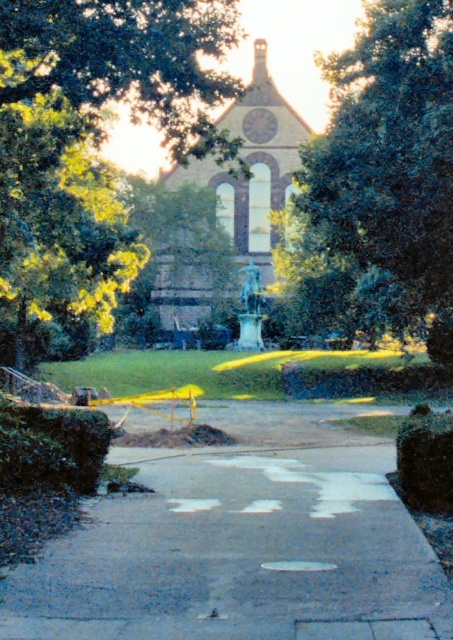
You are a tourist standing at the entrance of the park and want to take a photo of the gray concrete sidewalk at center and the green leafy tree at upper center. Which object should you focus on first to ensure both are in the frame?

You should focus on the gray concrete sidewalk at center first because it is below the green leafy tree at upper center, so positioning the sidewalk lower in the frame will include both objects.

You are a tourist standing at the entrance of the park and want to take a photo of the brown stone church at center. To avoid blocking the view with your friend standing on the gray concrete sidewalk at center, where should you position yourself relative to the sidewalk?

You should position yourself behind the gray concrete sidewalk at center because it is located below the brown stone church at center, so standing behind the sidewalk will ensure the church is visible without obstruction.